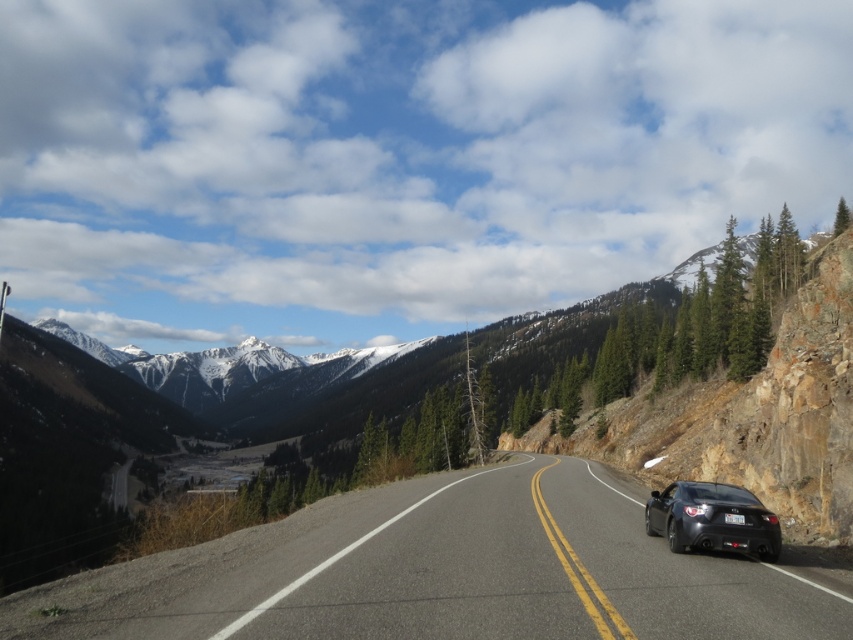
You are standing at the edge of the black asphalt road at center, and you want to walk to a point exactly 10 meters away from where you are standing. Can you reach that point without crossing the road?

The black asphalt road at center is only 8.18 meters away from the viewer, so if you want to walk 10 meters from your current position without crossing the road, you would need to walk along the road or towards the left side since the road itself is within your reach. However, since the road is 8.18 meters away, moving 10 meters straight ahead might take you beyond the road unless you stay on the same side.

You are a photographer planning to take a wide shot of the black asphalt road at center and the glossy black car at center. Since you want to ensure both are clearly visible in the frame, which object should you focus on first to avoid blurriness, considering their sizes in the image?

The black asphalt road at center has a greater height compared to the glossy black car at center, so you should focus on the black asphalt road at center first as it occupies more space in the frame and requires clearer focus to maintain detail.